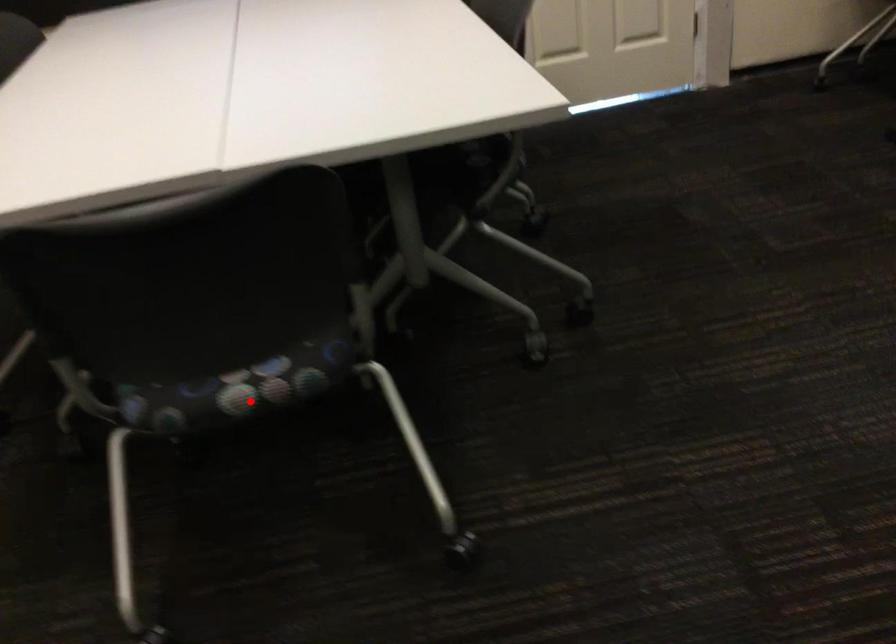
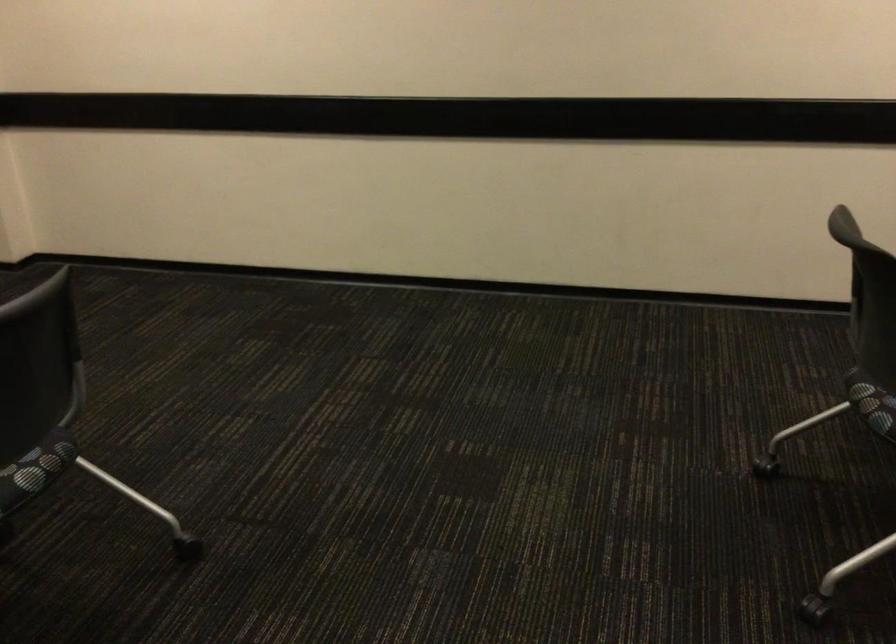
Locate, in the second image, the point that corresponds to the highlighted location in the first image.

(874, 408)